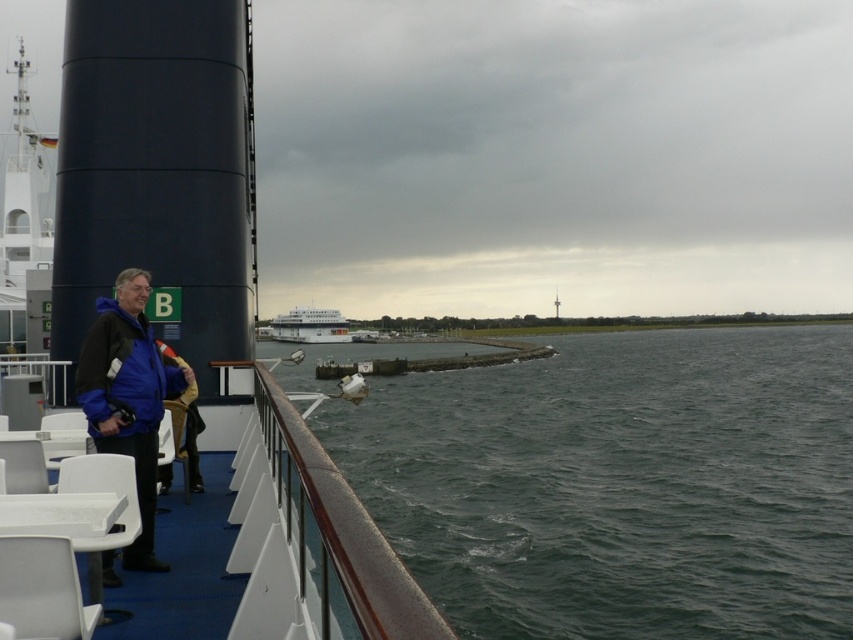
Measure the distance between blue fabric jacket at left and camera.

blue fabric jacket at left and camera are 5.84 meters apart.

Can you confirm if blue fabric jacket at left is bigger than blue fabric jacket at lower left?

Yes, blue fabric jacket at left is bigger than blue fabric jacket at lower left.

Where is `blue fabric jacket at left`? Image resolution: width=853 pixels, height=640 pixels. blue fabric jacket at left is located at coordinates point(128,396).

Identify the location of blue fabric jacket at left. (128, 396).

Does matte black boat at left appear under blue fabric jacket at lower left?

No, matte black boat at left is not below blue fabric jacket at lower left.

Between point (372, 552) and point (178, 401), which one is positioned behind?

The point (178, 401) is behind.

I want to click on matte black boat at left, so click(x=206, y=296).

Where is `matte black boat at left`? This screenshot has height=640, width=853. matte black boat at left is located at coordinates (206, 296).

Which is more to the left, blue fabric jacket at lower left or white glossy cruise ship at center?

From the viewer's perspective, white glossy cruise ship at center appears more on the left side.

Is point (184, 365) positioned after point (318, 323)?

No, it is not.

Locate an element on the screen. blue fabric jacket at lower left is located at coordinates (189, 433).